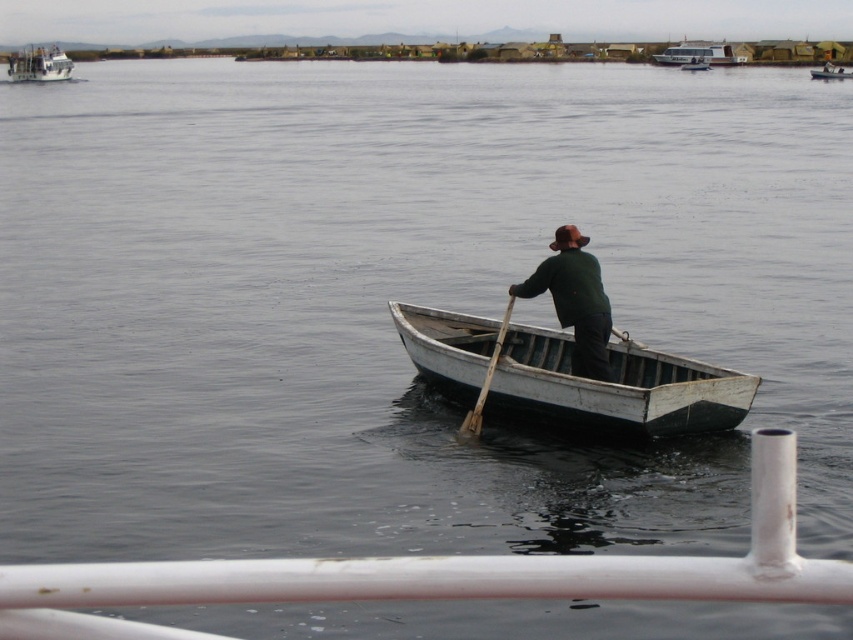
This screenshot has width=853, height=640. What do you see at coordinates (570, 376) in the screenshot?
I see `white wooden canoe at center` at bounding box center [570, 376].

The image size is (853, 640). What are the coordinates of `white wooden canoe at center` in the screenshot? It's located at (570, 376).

Locate an element on the screen. white wooden canoe at center is located at coordinates (570, 376).

Identify the location of white wooden canoe at center. (570, 376).

Does white wooden canoe at center have a larger size compared to white wooden boat at upper right?

Actually, white wooden canoe at center might be smaller than white wooden boat at upper right.

Between white wooden canoe at center and white wooden boat at upper right, which one is positioned lower?

white wooden canoe at center is lower down.

I want to click on white wooden canoe at center, so click(570, 376).

The image size is (853, 640). Identify the location of white wooden canoe at center. tap(570, 376).

Can you confirm if white wooden canoe at center is wider than wooden at center?

Correct, the width of white wooden canoe at center exceeds that of wooden at center.

Who is positioned more to the right, white wooden canoe at center or wooden at center?

Positioned to the right is white wooden canoe at center.

What do you see at coordinates (570, 376) in the screenshot? The image size is (853, 640). I see `white wooden canoe at center` at bounding box center [570, 376].

Identify the location of white wooden canoe at center. (570, 376).